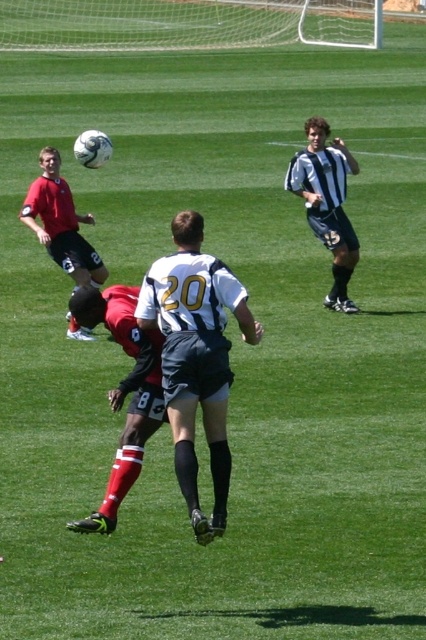
Can you confirm if red matte soccer player at center is shorter than matte red shirt at left?

No.

Which is in front, point (118, 477) or point (51, 161)?

Point (118, 477) is in front.

Where is `red matte soccer player at center`? red matte soccer player at center is located at coordinates (123, 390).

In the scene shown: Can you confirm if white matte jersey at center is bigger than red matte soccer player at center?

Yes, white matte jersey at center is bigger than red matte soccer player at center.

Can you confirm if white matte jersey at center is positioned to the left of red matte soccer player at center?

In fact, white matte jersey at center is to the right of red matte soccer player at center.

Does point (224, 508) come closer to viewer compared to point (129, 387)?

Yes, it is in front of point (129, 387).

Locate an element on the screen. The width and height of the screenshot is (426, 640). white matte jersey at center is located at coordinates (195, 356).

Is white matte jersey at center wider than matte red shirt at left?

No, white matte jersey at center is not wider than matte red shirt at left.

Which is behind, point (169, 316) or point (69, 241)?

The point (69, 241) is more distant.

Find the location of `white matte jersey at center`. white matte jersey at center is located at coordinates (195, 356).